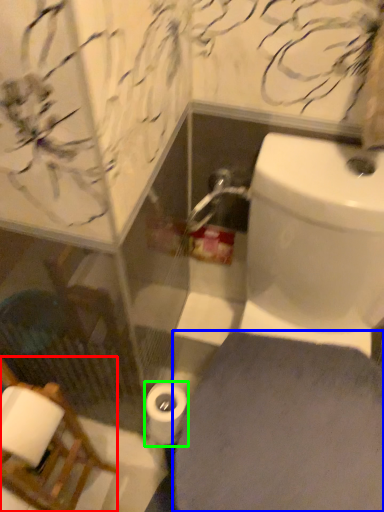
Question: Based on their relative distances, which object is farther from chair (highlighted by a red box)? Choose from porcelain (highlighted by a blue box) and toilet paper (highlighted by a green box).

Choices:
 (A) porcelain
 (B) toilet paper

Answer: (A)